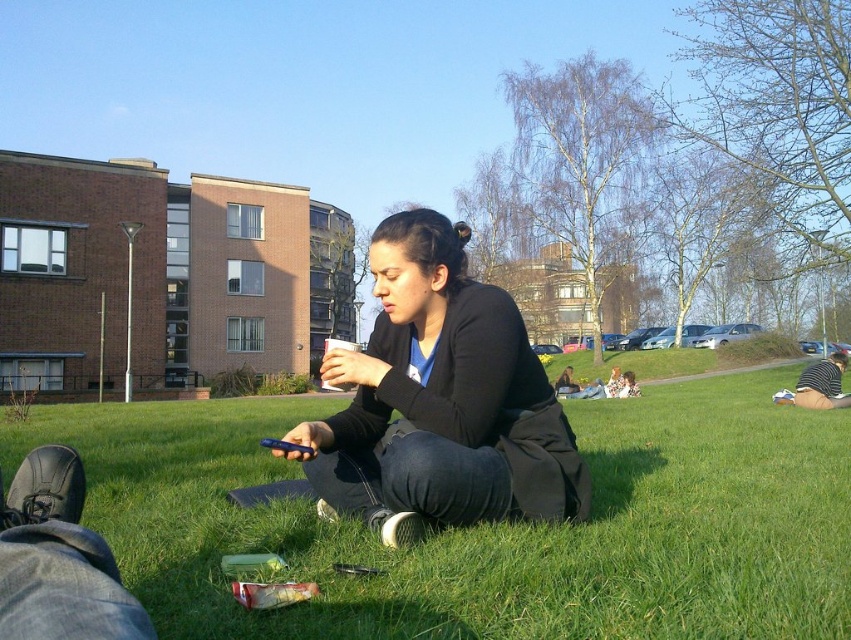
Does green grass at center appear under black matte jacket at center?

Yes.

Can you confirm if green grass at center is thinner than black matte jacket at center?

In fact, green grass at center might be wider than black matte jacket at center.

Is point (229, 420) farther from camera compared to point (433, 496)?

Yes, point (229, 420) is behind point (433, 496).

The height and width of the screenshot is (640, 851). I want to click on green grass at center, so click(490, 525).